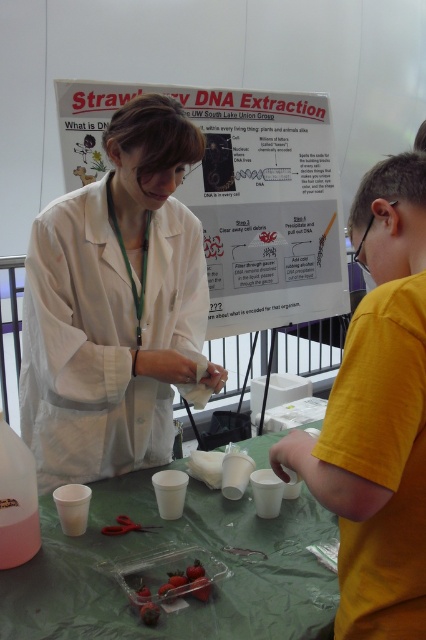
Question: Which object is farther from the camera taking this photo?

Choices:
 (A) yellow cotton shirt at center
 (B) white paperboard at center

Answer: (B)

Question: Which point is farther from the camera taking this photo?

Choices:
 (A) (134, 468)
 (B) (396, 266)
 (C) (233, 220)

Answer: (C)

Question: Is white lab coat at center to the right of white paperboard at center from the viewer's perspective?

Choices:
 (A) no
 (B) yes

Answer: (A)

Question: Can you confirm if white lab coat at center is bigger than white paperboard at center?

Choices:
 (A) yes
 (B) no

Answer: (B)

Question: Which point is farther to the camera?

Choices:
 (A) white lab coat at center
 (B) green plastic table at center

Answer: (A)

Question: Does white lab coat at center have a larger size compared to green plastic table at center?

Choices:
 (A) yes
 (B) no

Answer: (A)